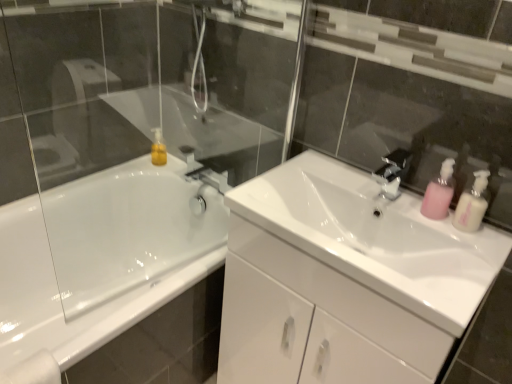
The width and height of the screenshot is (512, 384). In order to click on free space to the left of pink plastic soap dispenser at right, acting as the second soap dispenser starting from the right in this screenshot , I will do (381, 207).